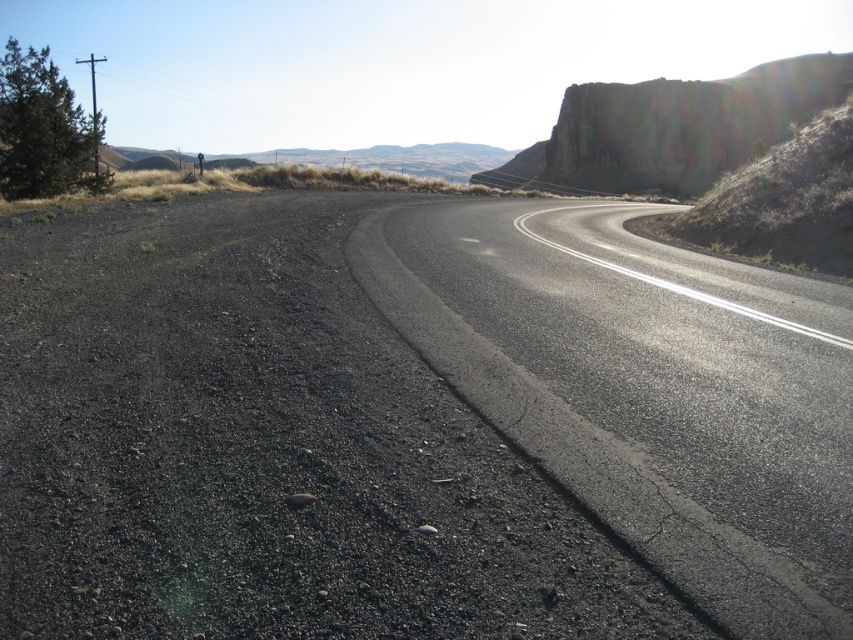
You are driving a truck that is 2.5 meters wide. You need to cross the black asphalt road at center. The rugged rock cliff at upper right is blocking part of the road. Can your truck safely pass through the road without hitting the cliff?

The black asphalt road at center is narrower than the rugged rock cliff at upper right. Since the road is narrower than the cliff, it might not provide enough space for the truck to pass safely. However, the description only mentions the road width being less than the cliff, but doesn not specify the exact width of the road. Without knowing the road width, it is impossible to determine if it is wide enough for the truck.

In the scene shown: You are standing at point (645,390) in the scene. Based on the description, what material are you standing on?

You are standing on the black asphalt road at center, as the Objects Description states that at point (645,390) lies black asphalt road at center.

You are driving a car and want to park near the rugged rock cliff at upper right. Is the black asphalt road at center the best place to park?

The black asphalt road at center is below rugged rock cliff at upper right, so parking on the road might not be safe due to potential falling rocks or unstable ground. It is better to find a safer parking area away from the cliff.